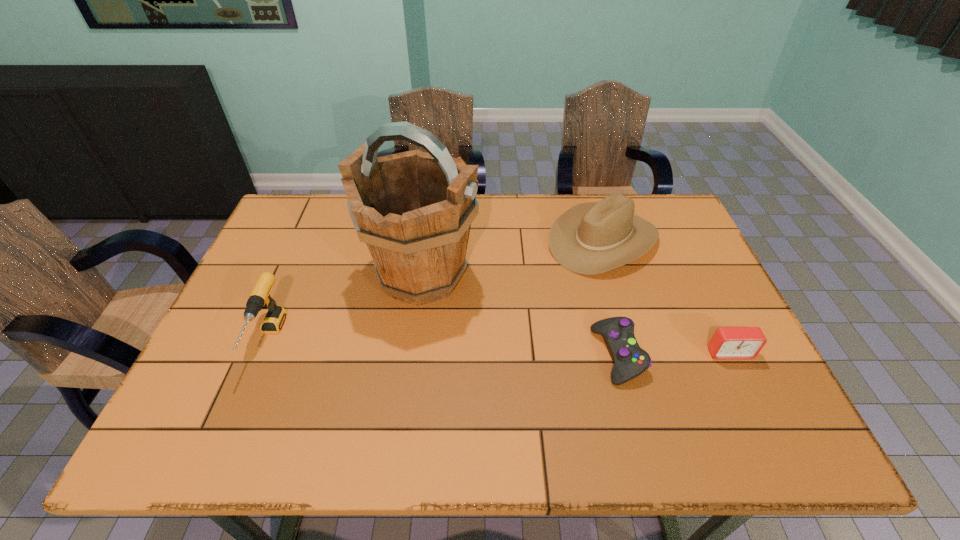
Identify the location of the fourth object from right to left. The image size is (960, 540). (413, 209).

Where is `bucket`? The height and width of the screenshot is (540, 960). bucket is located at coordinates (413, 209).

At what (x,y) coordinates should I click in order to perform the action: click on cowboy hat. Please return your answer as a coordinate pair (x, y). Image resolution: width=960 pixels, height=540 pixels. Looking at the image, I should click on (591, 238).

Locate an element on the screen. The height and width of the screenshot is (540, 960). drill is located at coordinates (259, 298).

At what (x,y) coordinates should I click in order to perform the action: click on alarm clock. Please return your answer as a coordinate pair (x, y). This screenshot has height=540, width=960. Looking at the image, I should click on (727, 342).

At what (x,y) coordinates should I click in order to perform the action: click on the shortest object. Please return your answer as a coordinate pair (x, y). The height and width of the screenshot is (540, 960). Looking at the image, I should click on (630, 360).

This screenshot has height=540, width=960. Find the location of `vacant space located 0.190m on the front of the second object from left to right`. vacant space located 0.190m on the front of the second object from left to right is located at coordinates (408, 385).

Where is `free space located on the left of the cowboy hat`? free space located on the left of the cowboy hat is located at coordinates (434, 240).

Find the location of a particular element. vacant area situated on the handle side of the leftmost object is located at coordinates (231, 427).

I want to click on vacant space located on the front-facing side of the fourth tallest object, so click(x=747, y=390).